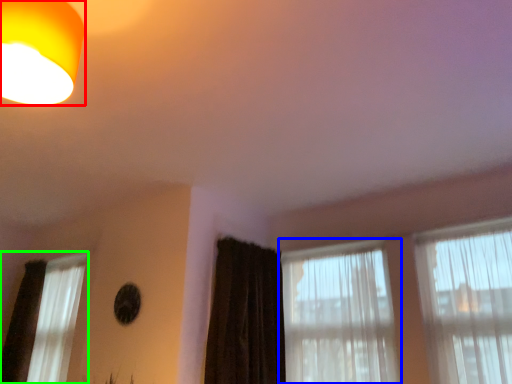
Question: Based on their relative distances, which object is nearer to lamp (highlighted by a red box)? Choose from window (highlighted by a blue box) and window (highlighted by a green box).

Choices:
 (A) window
 (B) window

Answer: (A)